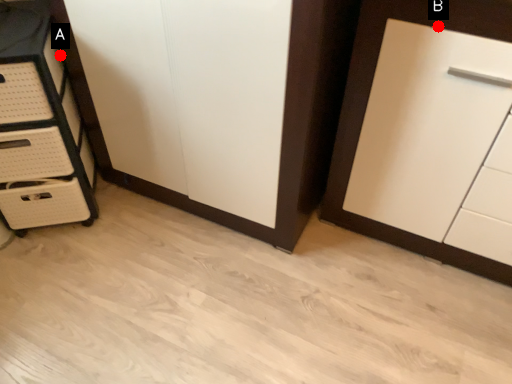
Question: Two points are circled on the image, labeled by A and B beside each circle. Which point is further to the camera?

Choices:
 (A) A is further
 (B) B is further

Answer: (A)